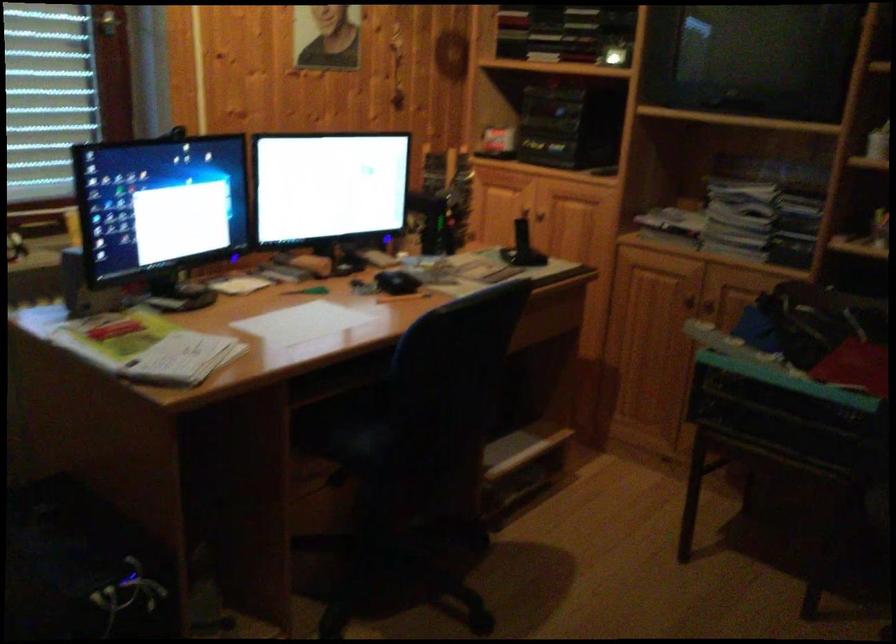
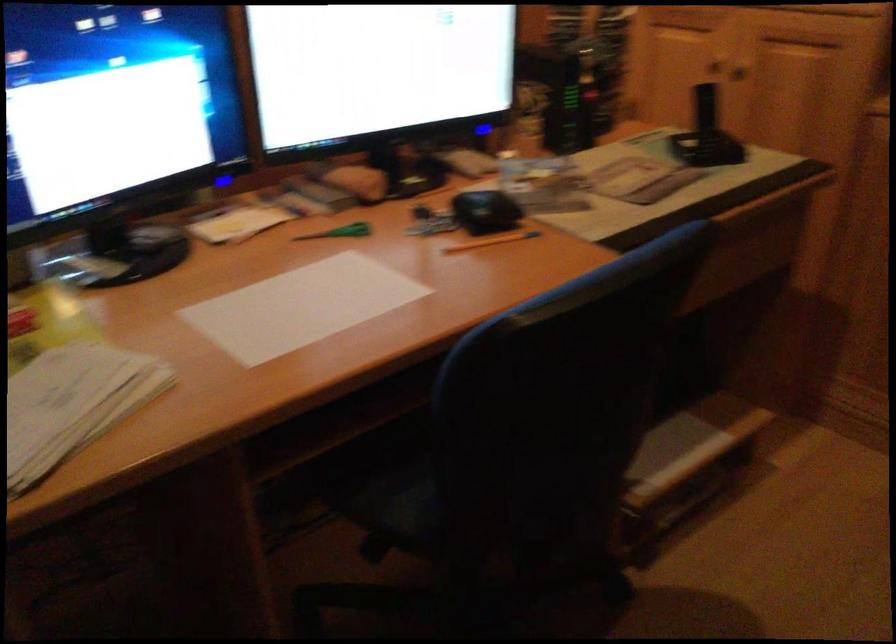
Where in the second image is the point corresponding to point (308, 289) from the first image?

(340, 232)